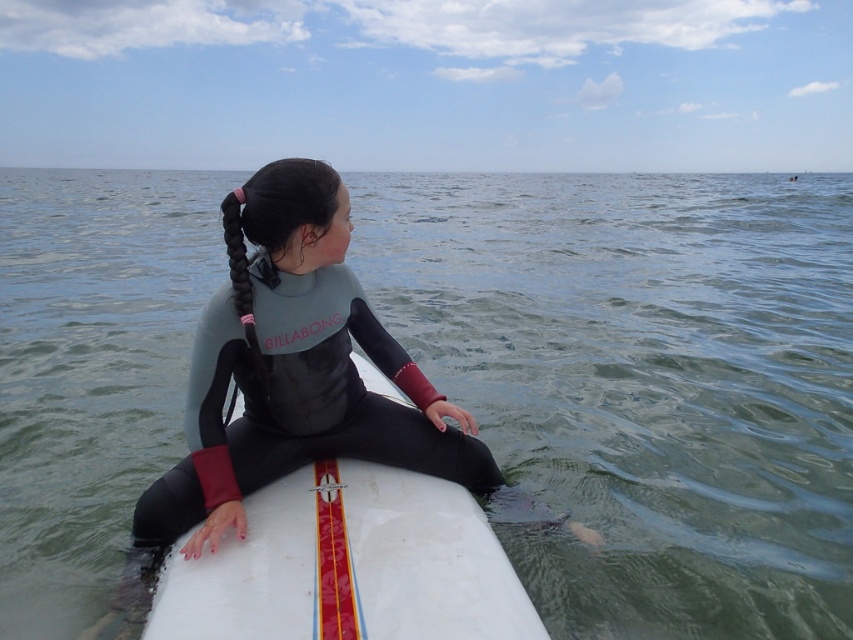
Who is more distant from viewer, (735, 584) or (428, 440)?

The point (735, 584) is behind.

Which is behind, point (759, 536) or point (376, 456)?

The point (759, 536) is more distant.

Image resolution: width=853 pixels, height=640 pixels. Identify the location of clear water at surfboard center. (643, 381).

Based on the photo, is white smooth surfboard at center to the right of gray matte wetsuit at center from the viewer's perspective?

Yes, white smooth surfboard at center is to the right of gray matte wetsuit at center.

Does white smooth surfboard at center have a lesser width compared to gray matte wetsuit at center?

Yes, white smooth surfboard at center is thinner than gray matte wetsuit at center.

Does point (422, 621) come behind point (206, 417)?

That is False.

At what (x,y) coordinates should I click in order to perform the action: click on white smooth surfboard at center. Please return your answer as a coordinate pair (x, y). This screenshot has width=853, height=640. Looking at the image, I should click on (349, 564).

Looking at this image, does clear water at surfboard center come behind white smooth surfboard at center?

Yes, clear water at surfboard center is behind white smooth surfboard at center.

Can you confirm if clear water at surfboard center is taller than white smooth surfboard at center?

Yes.

Between point (535, 544) and point (299, 611), which one is positioned in front?

Point (299, 611)

In order to click on clear water at surfboard center in this screenshot , I will do `click(643, 381)`.